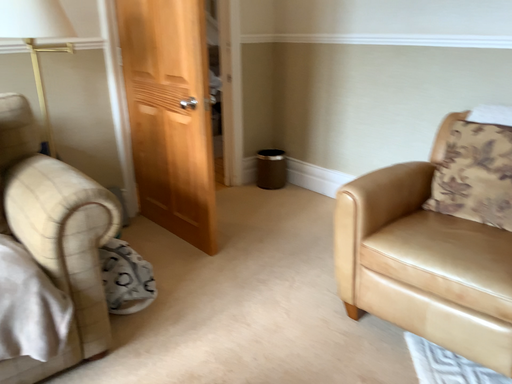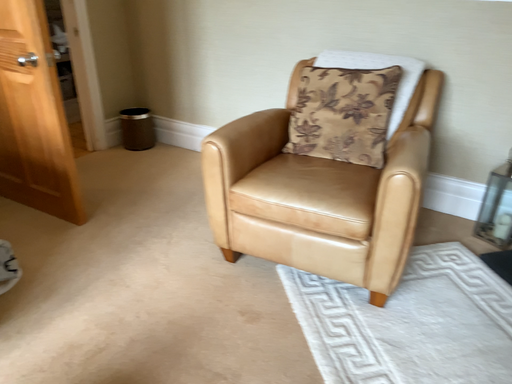
Question: How did the camera likely rotate when shooting the video?

Choices:
 (A) rotated right
 (B) rotated left

Answer: (A)